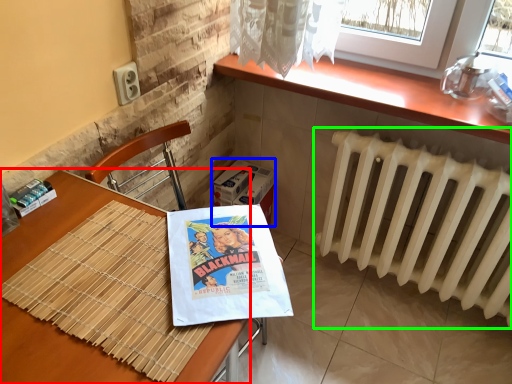
Question: Which object is the closest to the table (highlighted by a red box)? Choose among these: cardboard box (highlighted by a blue box) or radiator (highlighted by a green box).

Choices:
 (A) cardboard box
 (B) radiator

Answer: (A)